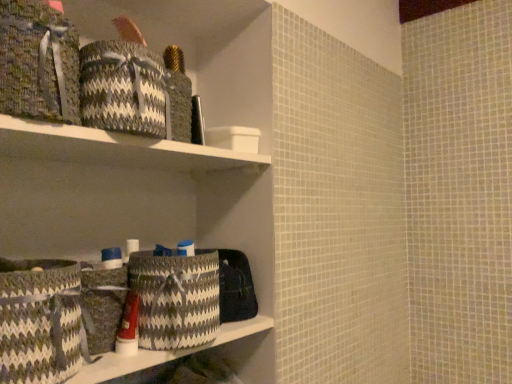
Question: Is woven fabric basket at upper left, acting as the 2th material starting from the right, taller than textured woven laundry basket at center?

Choices:
 (A) yes
 (B) no

Answer: (A)

Question: Is woven fabric basket at upper left, acting as the 2th material starting from the right, oriented towards textured woven laundry basket at center?

Choices:
 (A) yes
 (B) no

Answer: (B)

Question: Is textured woven laundry basket at center at the back of woven fabric basket at upper left, acting as the 2th material starting from the right?

Choices:
 (A) no
 (B) yes

Answer: (A)

Question: From the image's perspective, would you say woven fabric basket at upper left, acting as the 2th material starting from the right, is shown under textured woven laundry basket at center?

Choices:
 (A) no
 (B) yes

Answer: (A)

Question: Can you confirm if woven fabric basket at upper left, which appears as the first material when viewed from the left, is positioned to the right of textured woven laundry basket at center?

Choices:
 (A) yes
 (B) no

Answer: (B)

Question: Is point (41, 286) closer or farther from the camera than point (198, 344)?

Choices:
 (A) closer
 (B) farther

Answer: (A)

Question: From a real-world perspective, is textured woven basket at lower left, placed as the 2th basket when sorted from back to front, positioned above or below textured woven laundry basket at center?

Choices:
 (A) below
 (B) above

Answer: (A)

Question: Considering the positions of textured woven basket at lower left, placed as the 2th basket when sorted from back to front, and textured woven laundry basket at center in the image, is textured woven basket at lower left, placed as the 2th basket when sorted from back to front, bigger or smaller than textured woven laundry basket at center?

Choices:
 (A) big
 (B) small

Answer: (A)

Question: Considering their positions, is textured woven basket at lower left, the first basket positioned from the front, located in front of or behind textured woven laundry basket at center?

Choices:
 (A) front
 (B) behind

Answer: (A)

Question: Is textured woven basket at lower left spatially inside matte plastic tube at center, or outside of it?

Choices:
 (A) outside
 (B) inside

Answer: (A)

Question: From the image's perspective, is textured woven basket at lower left positioned above or below matte plastic tube at center?

Choices:
 (A) above
 (B) below

Answer: (B)

Question: Is textured woven basket at lower left in front of or behind matte plastic tube at center in the image?

Choices:
 (A) behind
 (B) front

Answer: (B)

Question: Looking at their shapes, would you say textured woven basket at lower left is wider or thinner than matte plastic tube at center?

Choices:
 (A) wide
 (B) thin

Answer: (A)

Question: Considering the positions of point (128, 135) and point (124, 291), is point (128, 135) closer or farther from the camera than point (124, 291)?

Choices:
 (A) closer
 (B) farther

Answer: (A)

Question: Visually, is white matte shelf at upper center positioned to the left or to the right of textured woven basket at lower left, the second basket in the front-to-back sequence?

Choices:
 (A) right
 (B) left

Answer: (A)